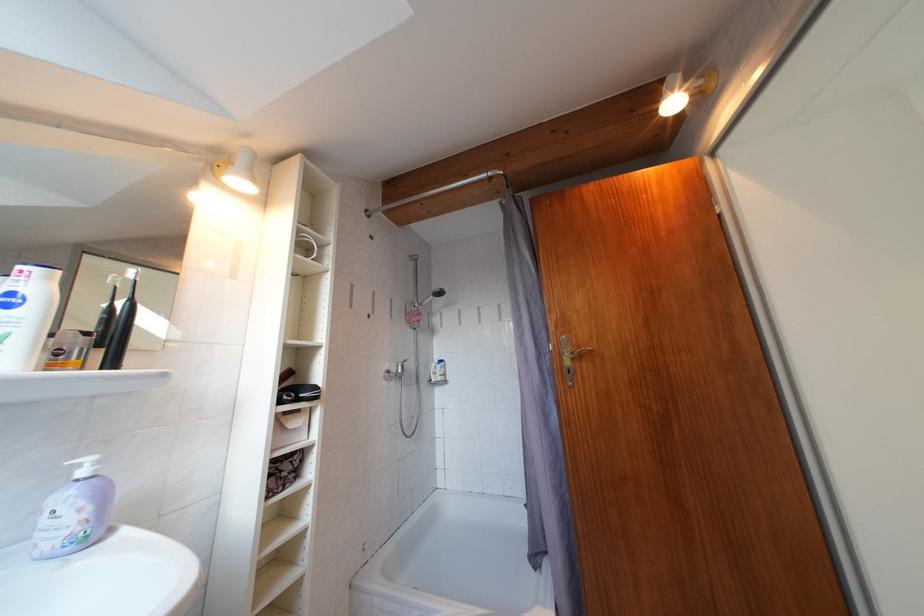
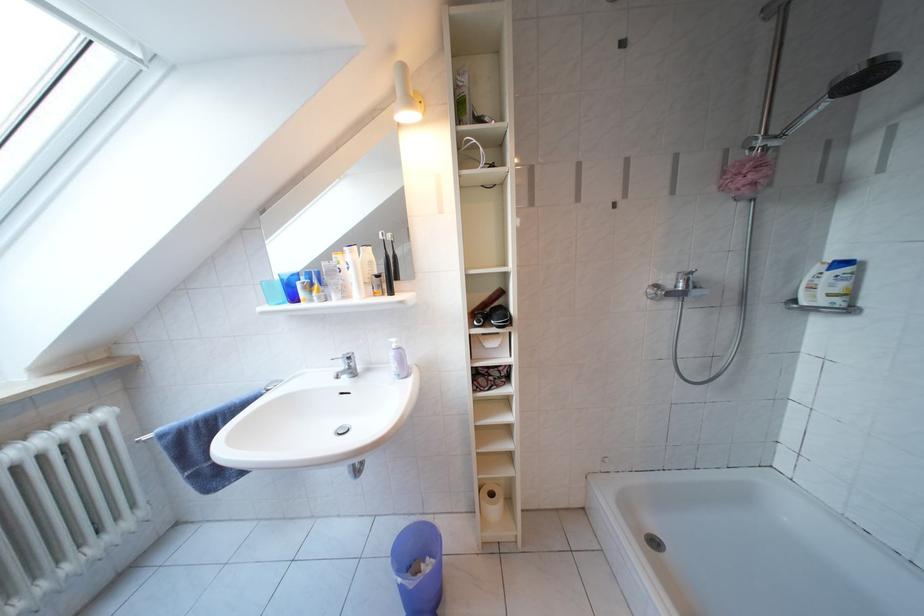
In the second image, find the point that corresponds to (98,464) in the first image.

(402, 345)